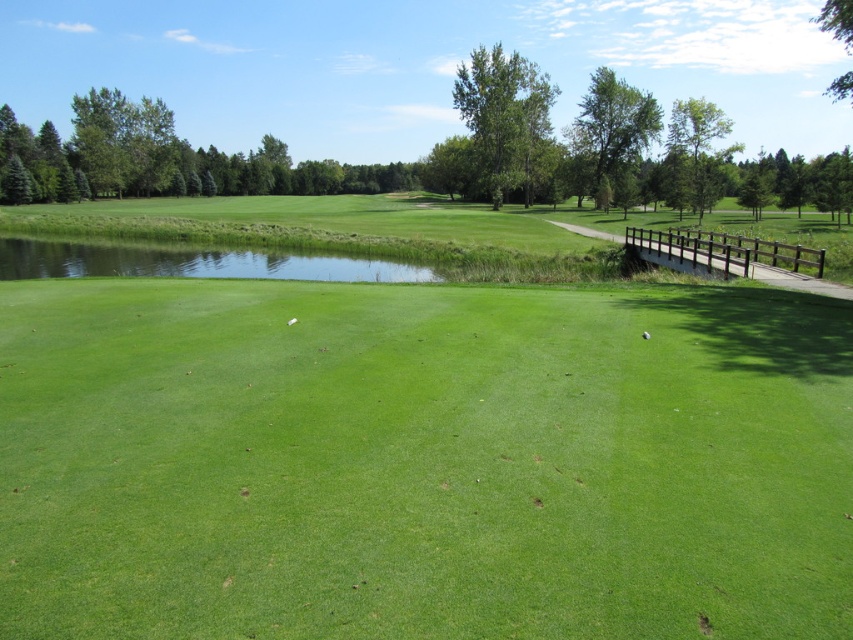
Does green grassy golf course at center have a smaller size compared to green smooth golf ball at center?

Incorrect, green grassy golf course at center is not smaller in size than green smooth golf ball at center.

You are a GUI agent. You are given a task and a screenshot of the screen. Output one action in this format:
    pyautogui.click(x=<x>, y=<y>)
    Task: Click on the green grassy golf course at center
    The image size is (853, 640).
    Given the screenshot: What is the action you would take?
    pyautogui.click(x=422, y=460)

Can you confirm if green grassy golf course at center is positioned below clear water at center?

Correct, green grassy golf course at center is located below clear water at center.

This screenshot has width=853, height=640. Describe the element at coordinates (422, 460) in the screenshot. I see `green grassy golf course at center` at that location.

Where is `green grassy golf course at center`? green grassy golf course at center is located at coordinates (422, 460).

Is clear water at center to the left of green smooth golf ball at center from the viewer's perspective?

Correct, you'll find clear water at center to the left of green smooth golf ball at center.

Who is positioned more to the left, clear water at center or green smooth golf ball at center?

Positioned to the left is clear water at center.

Does point (157, 275) come behind point (643, 333)?

That is True.

Where is `clear water at center`? This screenshot has width=853, height=640. clear water at center is located at coordinates (190, 262).